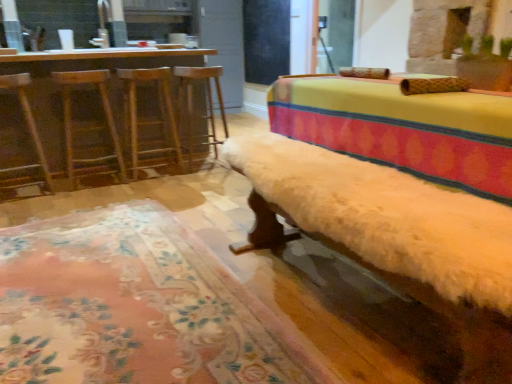
Locate an element on the screen. The height and width of the screenshot is (384, 512). vacant space in wooden swivel chair at left, arranged as the 1th swivel chair when viewed from the left (from a real-world perspective) is located at coordinates (23, 195).